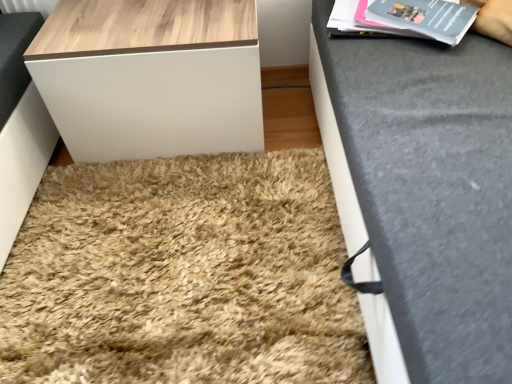
Question: Does wooden table at upper left have a lesser height compared to beige shaggy rug at center?

Choices:
 (A) yes
 (B) no

Answer: (B)

Question: Considering the relative positions of wooden table at upper left and beige shaggy rug at center in the image provided, is wooden table at upper left to the left of beige shaggy rug at center from the viewer's perspective?

Choices:
 (A) no
 (B) yes

Answer: (B)

Question: Is wooden table at upper left directly adjacent to beige shaggy rug at center?

Choices:
 (A) no
 (B) yes

Answer: (A)

Question: Is wooden table at upper left further to camera compared to beige shaggy rug at center?

Choices:
 (A) no
 (B) yes

Answer: (B)

Question: Is the position of wooden table at upper left less distant than that of beige shaggy rug at center?

Choices:
 (A) no
 (B) yes

Answer: (A)

Question: Does point (194, 104) appear closer or farther from the camera than point (184, 180)?

Choices:
 (A) farther
 (B) closer

Answer: (B)

Question: Is wooden table at upper left wider or thinner than beige shaggy rug at center?

Choices:
 (A) wide
 (B) thin

Answer: (B)

Question: Is wooden table at upper left taller or shorter than beige shaggy rug at center?

Choices:
 (A) tall
 (B) short

Answer: (A)

Question: Looking at the image, does wooden table at upper left seem bigger or smaller compared to beige shaggy rug at center?

Choices:
 (A) big
 (B) small

Answer: (A)

Question: Visually, is matte gray magazine at upper right positioned to the left or to the right of beige shaggy rug at center?

Choices:
 (A) right
 (B) left

Answer: (A)

Question: In terms of height, does matte gray magazine at upper right look taller or shorter compared to beige shaggy rug at center?

Choices:
 (A) short
 (B) tall

Answer: (A)

Question: From the image's perspective, relative to beige shaggy rug at center, is matte gray magazine at upper right above or below?

Choices:
 (A) above
 (B) below

Answer: (A)

Question: Relative to beige shaggy rug at center, is matte gray magazine at upper right in front or behind?

Choices:
 (A) behind
 (B) front

Answer: (A)

Question: From the image's perspective, relative to matte gray magazine at upper right, is wooden table at upper left above or below?

Choices:
 (A) below
 (B) above

Answer: (A)

Question: Visually, is wooden table at upper left positioned to the left or to the right of matte gray magazine at upper right?

Choices:
 (A) left
 (B) right

Answer: (A)